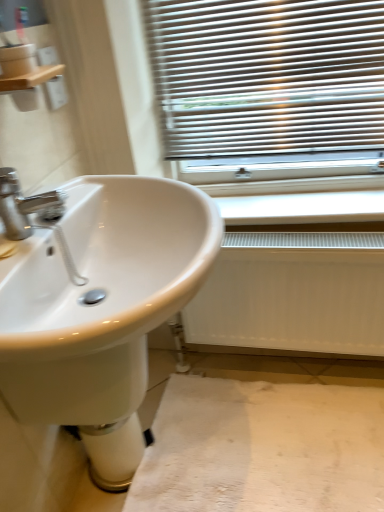
Question: Would you consider white glossy bidet at lower center to be distant from white fabric at lower center?

Choices:
 (A) no
 (B) yes

Answer: (A)

Question: Does white glossy bidet at lower center come behind white fabric at lower center?

Choices:
 (A) yes
 (B) no

Answer: (A)

Question: Considering the relative sizes of white glossy bidet at lower center and white fabric at lower center in the image provided, is white glossy bidet at lower center bigger than white fabric at lower center?

Choices:
 (A) no
 (B) yes

Answer: (A)

Question: Is white glossy bidet at lower center looking in the opposite direction of white fabric at lower center?

Choices:
 (A) no
 (B) yes

Answer: (A)

Question: Is white glossy bidet at lower center outside white fabric at lower center?

Choices:
 (A) yes
 (B) no

Answer: (A)

Question: Is white glossy bidet at lower center situated inside white matte radiator at lower right or outside?

Choices:
 (A) inside
 (B) outside

Answer: (B)

Question: From a real-world perspective, relative to white matte radiator at lower right, is white glossy bidet at lower center vertically above or below?

Choices:
 (A) below
 (B) above

Answer: (A)

Question: Considering their positions, is white glossy bidet at lower center located in front of or behind white matte radiator at lower right?

Choices:
 (A) front
 (B) behind

Answer: (A)

Question: From the image's perspective, relative to white matte radiator at lower right, is white glossy bidet at lower center above or below?

Choices:
 (A) below
 (B) above

Answer: (A)

Question: In terms of height, does wooden shelf at upper left look taller or shorter compared to white glossy sink at left?

Choices:
 (A) tall
 (B) short

Answer: (B)

Question: Is wooden shelf at upper left to the left or to the right of white glossy sink at left in the image?

Choices:
 (A) right
 (B) left

Answer: (B)

Question: From a real-world perspective, is wooden shelf at upper left positioned above or below white glossy sink at left?

Choices:
 (A) above
 (B) below

Answer: (A)

Question: Is wooden shelf at upper left in front of or behind white glossy sink at left in the image?

Choices:
 (A) behind
 (B) front

Answer: (A)

Question: Would you say wooden shelf at upper left is to the left or to the right of white plastic radiator at lower center in the picture?

Choices:
 (A) left
 (B) right

Answer: (A)

Question: From the image's perspective, is wooden shelf at upper left located above or below white plastic radiator at lower center?

Choices:
 (A) above
 (B) below

Answer: (A)